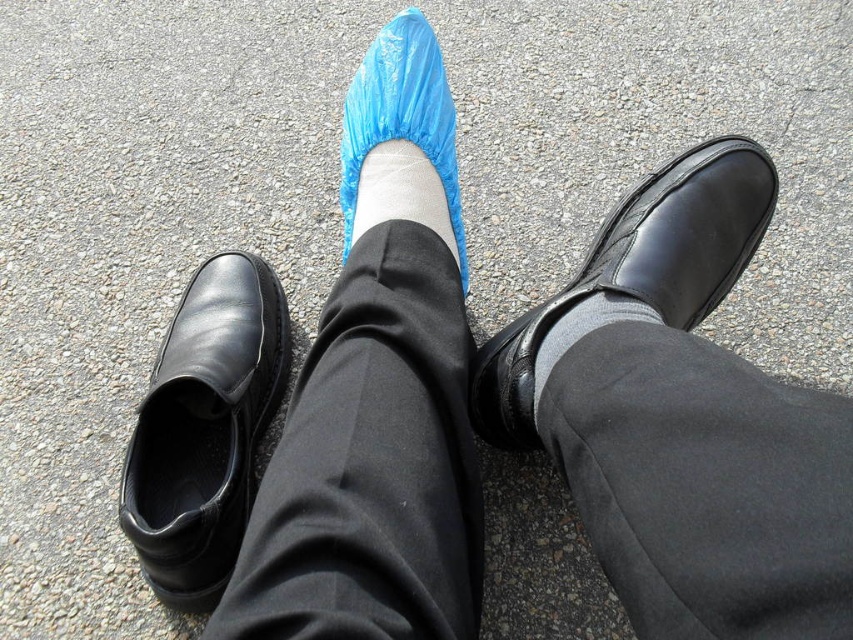
You are a security guard at a facility that requires all shoes to be positioned within a restricted area marked by coordinates between 0.3 and 0.7 on the x and y axes. You observe the black leather shoe at upper right in the image. Is its position compliant with the facility requirements?

The black leather shoe at upper right is positioned at coordinates (x=639, y=269). Since both values fall within the 0.3 to 0.7 range, its position is compliant with the facility requirements.

You are a photographer adjusting your camera to focus on two points in the image. You notice that point (258, 275) and point (364, 227) are both in the frame. Which point is closer to your camera?

Point (258, 275) is further to the camera than point (364, 227), so the closer point to your camera is point (364, 227).

From the picture: You are a healthcare worker entering a restricted area and must ensure that your footwear is fully covered. You notice your black leather shoe at left and white matte sock at center. Which object needs to be covered to comply with the policy?

The white matte sock at center needs to be covered because it is positioned over the black leather shoe at left, making it visible and potentially exposed.